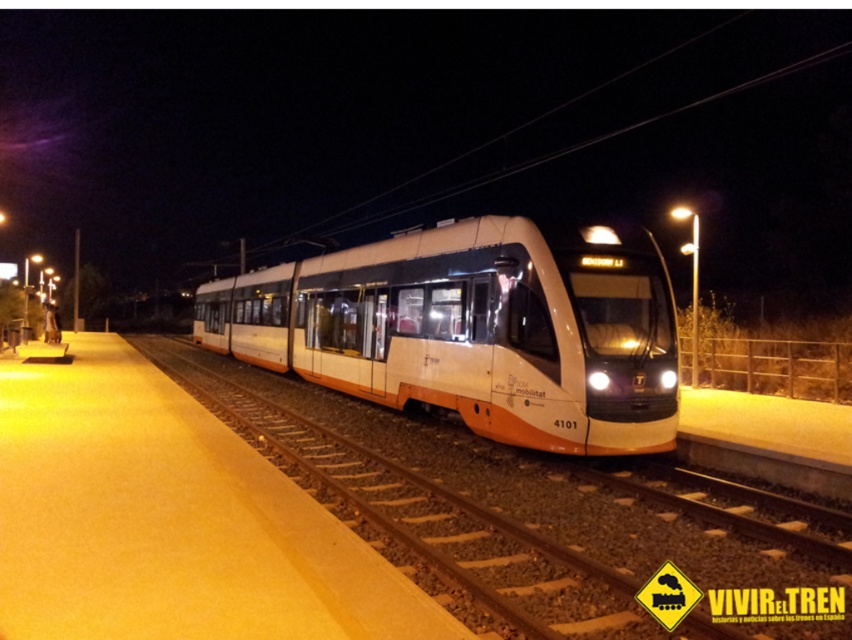
Describe the element at coordinates (532, 515) in the screenshot. I see `white metallic track at center` at that location.

Which of these two, white metallic track at center or white glossy train at center, stands shorter?

white metallic track at center

The height and width of the screenshot is (640, 852). Describe the element at coordinates (532, 515) in the screenshot. I see `white metallic track at center` at that location.

Image resolution: width=852 pixels, height=640 pixels. Find the location of `white metallic track at center`. white metallic track at center is located at coordinates (x=532, y=515).